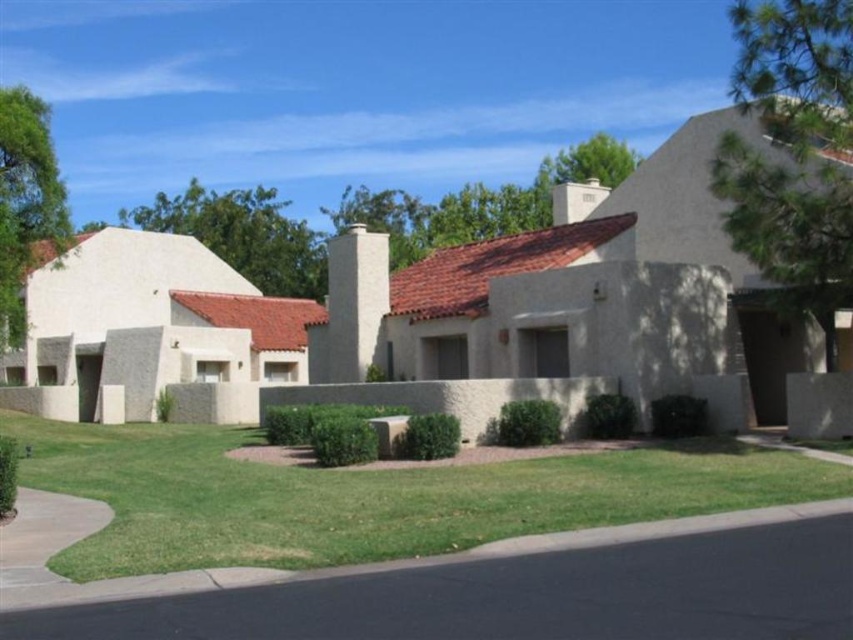
You are standing in the residential area looking at the green textured pine tree at upper right and the green leafy tree at upper center. Which tree is nearer to you?

The green textured pine tree at upper right is closer to the viewer than the green leafy tree at upper center, so it is nearer to you.

You are standing at the entrance of the residential area and see the point marked as point [792,150]. Based on the scene description, what object is located at this point?

The point [792,150] corresponds to the green textured pine tree at upper right.